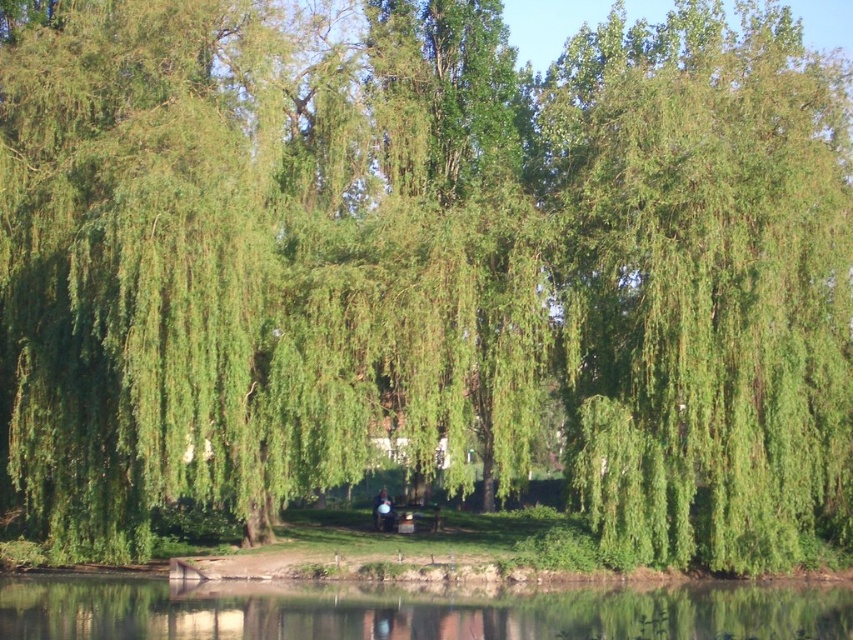
Question: Which object is farther from the camera taking this photo?

Choices:
 (A) transparent water at bottom
 (B) green leafy willow at upper right
 (C) smooth skin person at center

Answer: (C)

Question: Can you confirm if green leafy willow at upper right is positioned to the left of transparent water at bottom?

Choices:
 (A) yes
 (B) no

Answer: (B)

Question: Among these points, which one is farthest from the camera?

Choices:
 (A) (373, 508)
 (B) (697, 344)
 (C) (633, 602)

Answer: (A)

Question: Which of the following is the closest to the observer?

Choices:
 (A) green leafy willow at upper right
 (B) transparent water at bottom
 (C) smooth skin person at center

Answer: (B)

Question: Does green leafy willow at upper right have a smaller size compared to transparent water at bottom?

Choices:
 (A) no
 (B) yes

Answer: (A)

Question: Does green leafy willow at upper right have a greater width compared to smooth skin person at center?

Choices:
 (A) no
 (B) yes

Answer: (B)